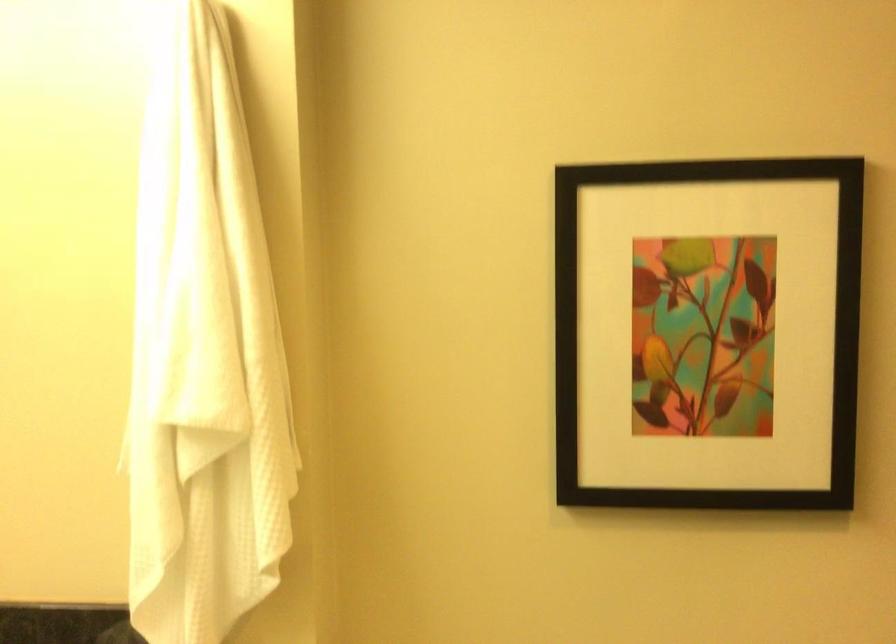
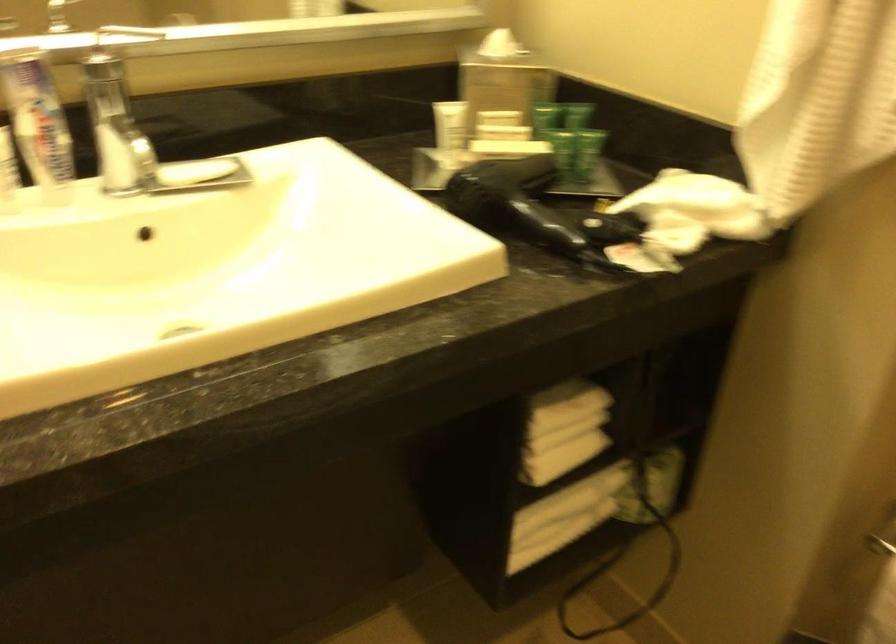
The first image is from the beginning of the video and the second image is from the end. How did the camera likely rotate when shooting the video?

The camera rotated toward left-down.